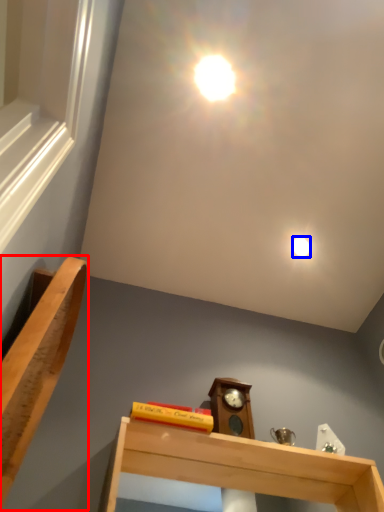
Question: Which object is further to the camera taking this photo, furniture (highlighted by a red box) or droplight (highlighted by a blue box)?

Choices:
 (A) furniture
 (B) droplight

Answer: (B)